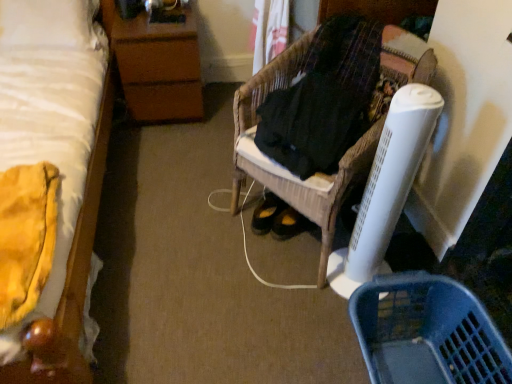
Where is `free space in front of woven wood chair at center`? free space in front of woven wood chair at center is located at coordinates (265, 315).